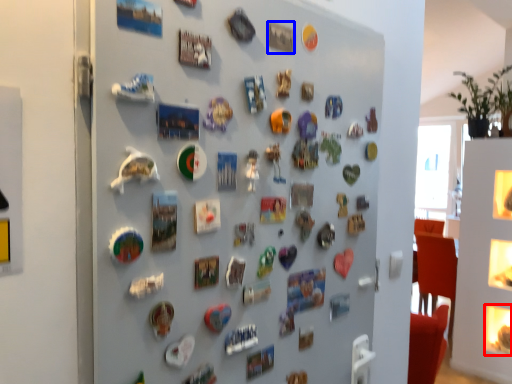
Question: Which of the following is the closest to the observer, button (highlighted by a red box) or button (highlighted by a blue box)?

Choices:
 (A) button
 (B) button

Answer: (B)